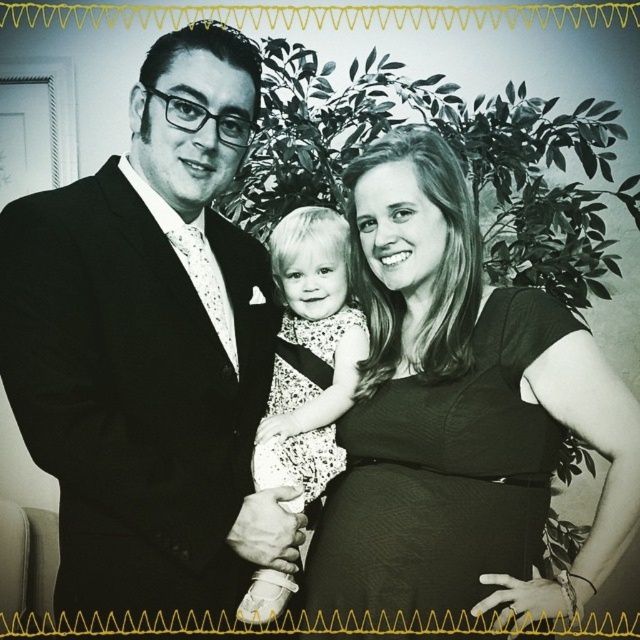
In the family portrait, you notice the black satin suit at left and the white dotted dress at center. Which clothing item is positioned further to the left side of the image?

The black satin suit at left is positioned further to the left side of the image than the white dotted dress at center.

You are a photographer adjusting the lighting for a family portrait. You notice the black satin suit at left and the white dotted dress at center. To ensure both are evenly lit, which object should you move closer to the light source?

The white dotted dress at center should be moved closer to the light source because lighter colors like white reflect more light and may require less direct illumination compared to darker fabrics such as the black satin suit at left. However, since the black satin suit at left is 8.36 inches away from the white dotted dress at center, adjusting their positions could help balance the lighting between them.